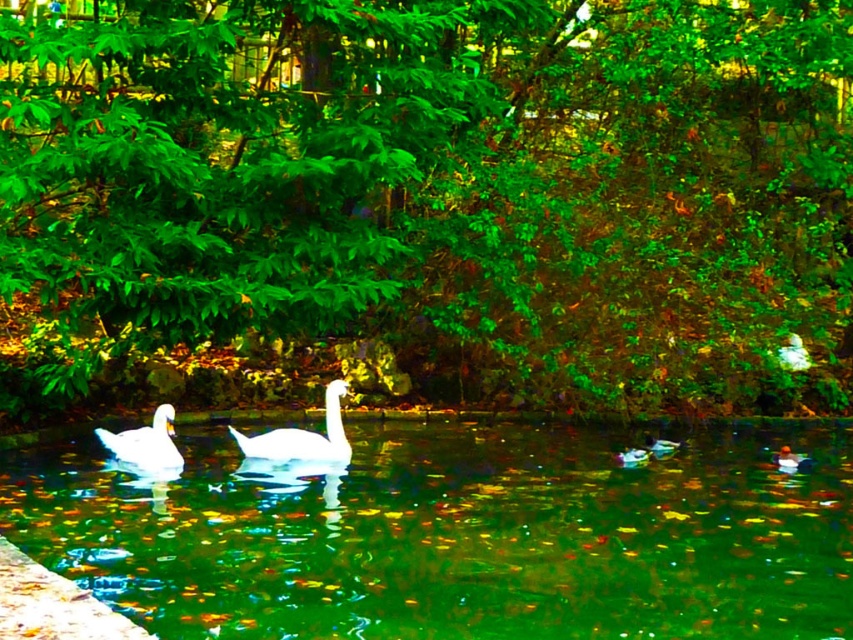
You are a bird flying over the pond and want to land on the green leafy tree at center. However, there is a white glossy swan at center in the way. Can you safely land on the tree without disturbing the swan?

The green leafy tree at center is above the white glossy swan at center, so yes, you can safely land on the tree without disturbing the swan since the tree is positioned higher up and the swan is below.

From the picture: You are a photographer trying to capture the white glossy swan at left and the clear water at center in a single shot. Based on their positions, which object would you focus on first to ensure both are in frame?

You should focus on the clear water at center first because it is wider than the white glossy swan at left, ensuring both are captured in the frame.

You are a birdwatcher observing the scene. You notice the green leafy tree at center and the white glossy swan at center. Which object is wider in the image?

The white glossy swan at center is wider than the green leafy tree at center.